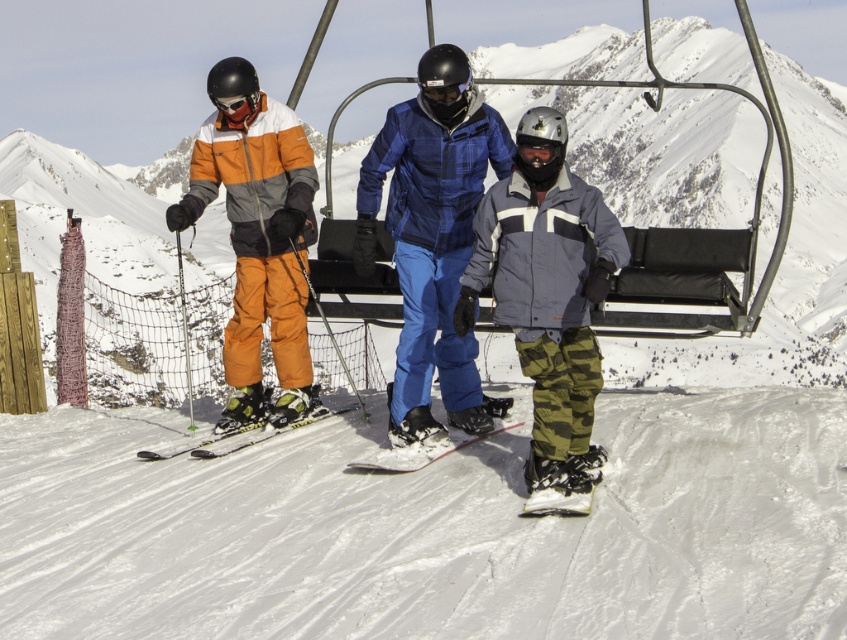
In the scene shown: Is white snow at lower center above camouflage snow pants at center?

Actually, white snow at lower center is below camouflage snow pants at center.

Who is more distant from viewer, (352, 486) or (512, 236)?

The point (512, 236) is more distant.

At what (x,y) coordinates should I click in order to perform the action: click on white snow at lower center. Please return your answer as a coordinate pair (x, y). Looking at the image, I should click on (432, 529).

Between yellow-green plastic skis at lower left and white matte snowboard at center, which one is positioned lower?

white matte snowboard at center is below.

Is yellow-green plastic skis at lower left above white matte snowboard at center?

Yes.

Is point (263, 426) farther from camera compared to point (413, 468)?

Yes.

Identify the location of yellow-green plastic skis at lower left. (237, 438).

Can you confirm if camouflage snow pants at center is taller than orange matte ski pants at left?

In fact, camouflage snow pants at center may be shorter than orange matte ski pants at left.

Which is below, camouflage snow pants at center or orange matte ski pants at left?

camouflage snow pants at center

This screenshot has height=640, width=847. In order to click on camouflage snow pants at center in this screenshot , I will do `click(547, 300)`.